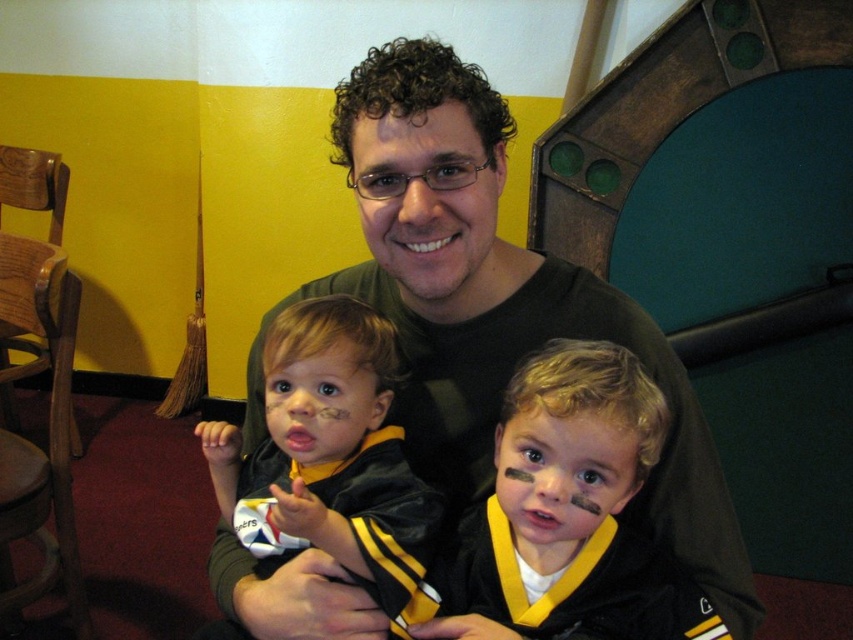
Does black matte jersey at center appear over matte black jacket at center?

Actually, black matte jersey at center is below matte black jacket at center.

The image size is (853, 640). What are the coordinates of `black matte jersey at center` in the screenshot? It's located at (570, 513).

You are a GUI agent. You are given a task and a screenshot of the screen. Output one action in this format:
    pyautogui.click(x=<x>, y=<y>)
    Task: Click on the black matte jersey at center
    This screenshot has width=853, height=640.
    Given the screenshot: What is the action you would take?
    pyautogui.click(x=570, y=513)

Does black matte shirt at center appear on the left side of matte black jacket at center?

No, black matte shirt at center is not to the left of matte black jacket at center.

Between point (436, 340) and point (409, 552), which one is positioned in front?

Positioned in front is point (409, 552).

What do you see at coordinates (492, 305) in the screenshot? I see `black matte shirt at center` at bounding box center [492, 305].

What are the coordinates of `black matte shirt at center` in the screenshot? It's located at (492, 305).

Does black matte shirt at center lie in front of black matte jersey at center?

No, black matte shirt at center is further to the viewer.

Measure the distance between black matte shirt at center and camera.

black matte shirt at center and camera are 27.26 inches apart.

Find the location of a particular element. The height and width of the screenshot is (640, 853). black matte shirt at center is located at coordinates (492, 305).